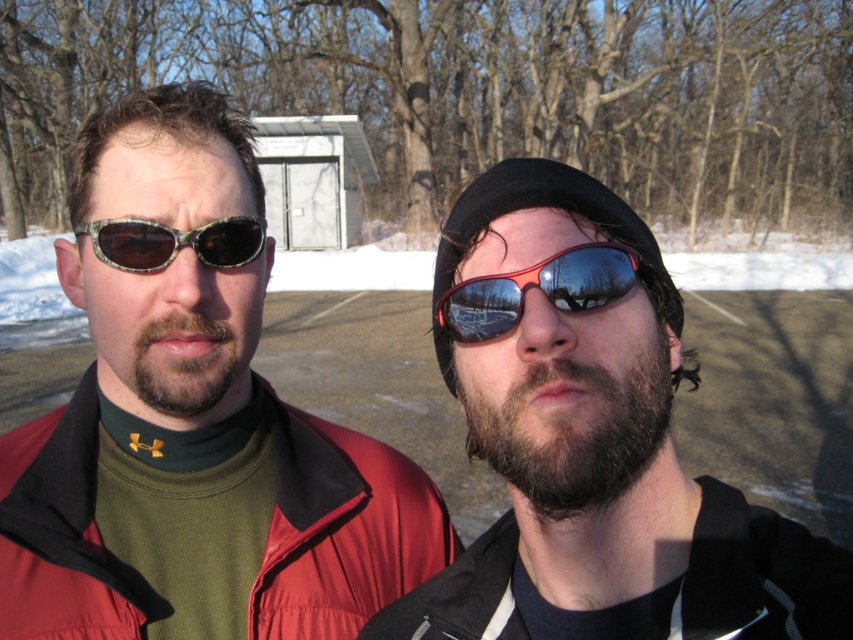
You are a photographer trying to capture both the black fleece jacket at lower right and the shiny red plastic goggles at center in a single frame. Based on their sizes in the image, which object should you focus on first to ensure both are in focus?

The black fleece jacket at lower right is much taller than the shiny red plastic goggles at center. To ensure both are in focus, you should focus on the larger object first, which is the black fleece jacket at lower right, as it requires more depth of field coverage.